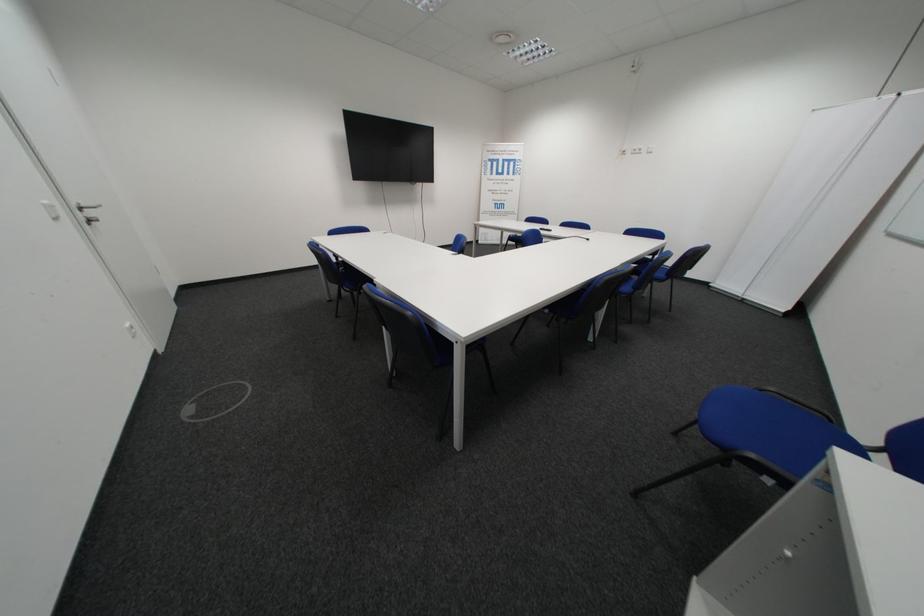
Find where to pull the silver door handle. Please return your answer as a coordinate pair (x, y).

(89, 212)